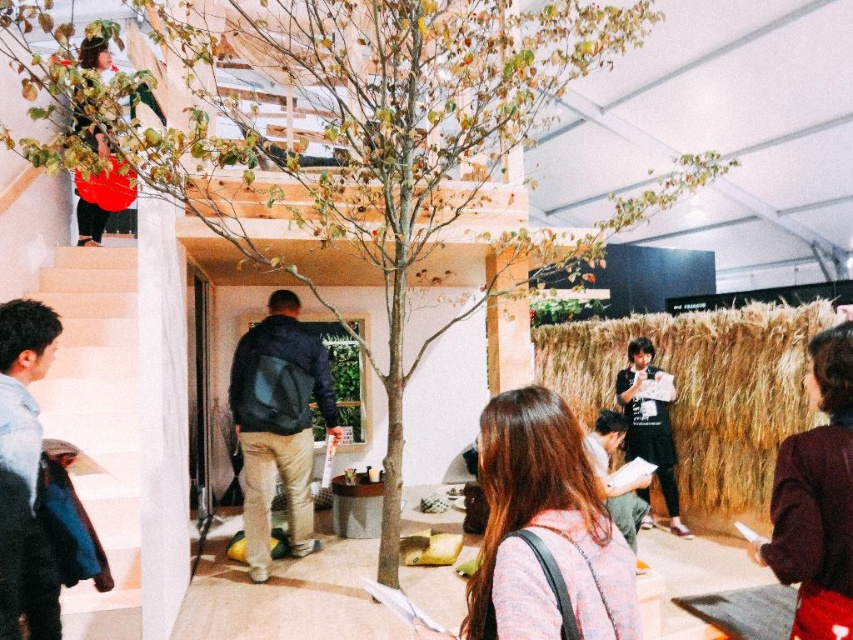
Question: Which is farther from the brown straw wall at right?

Choices:
 (A) maroon fabric coat at lower right
 (B) white matte stairs at lower left
 (C) black cotton shirt at center

Answer: (B)

Question: Is brown straw wall at right positioned before white matte stairs at lower left?

Choices:
 (A) no
 (B) yes

Answer: (A)

Question: Which of these objects is positioned farthest from the dark brown leather jacket at lower center?

Choices:
 (A) brown straw wall at right
 (B) white matte stairs at lower left
 (C) maroon fabric coat at lower right
 (D) blue denim jacket at lower left

Answer: (B)

Question: Can you confirm if black cotton shirt at center is bigger than matte red dress at upper left?

Choices:
 (A) no
 (B) yes

Answer: (B)

Question: Considering the relative positions of brown straw wall at right and dark brown leather jacket at lower center in the image provided, where is brown straw wall at right located with respect to dark brown leather jacket at lower center?

Choices:
 (A) right
 (B) left

Answer: (A)

Question: Which point is closer to the camera taking this photo?

Choices:
 (A) [x=666, y=442]
 (B) [x=608, y=454]

Answer: (B)